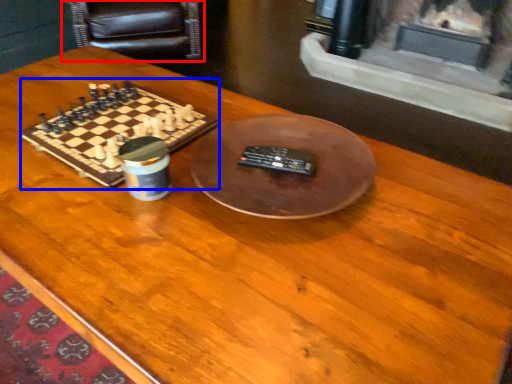
Question: Among these objects, which one is farthest to the camera, armchair (highlighted by a red box) or board game (highlighted by a blue box)?

Choices:
 (A) armchair
 (B) board game

Answer: (A)